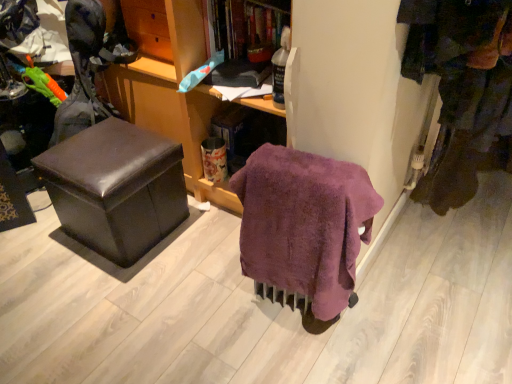
Question: Could you tell me if wooden shelf at upper center, which ranks as the first shelf in left-to-right order, is turned towards shiny brown ottoman at left?

Choices:
 (A) yes
 (B) no

Answer: (B)

Question: Considering the relative sizes of wooden shelf at upper center, which ranks as the first shelf in left-to-right order, and shiny brown ottoman at left in the image provided, is wooden shelf at upper center, which ranks as the first shelf in left-to-right order, thinner than shiny brown ottoman at left?

Choices:
 (A) yes
 (B) no

Answer: (A)

Question: Is the position of wooden shelf at upper center, which ranks as the first shelf in left-to-right order, more distant than that of shiny brown ottoman at left?

Choices:
 (A) no
 (B) yes

Answer: (B)

Question: Does wooden shelf at upper center, which ranks as the first shelf in left-to-right order, have a greater width compared to shiny brown ottoman at left?

Choices:
 (A) no
 (B) yes

Answer: (A)

Question: Is wooden shelf at upper center, which ranks as the first shelf in left-to-right order, shorter than shiny brown ottoman at left?

Choices:
 (A) yes
 (B) no

Answer: (A)

Question: Is wooden shelf at upper center, positioned as the 2th shelf in right-to-left order, far from shiny brown ottoman at left?

Choices:
 (A) no
 (B) yes

Answer: (A)

Question: Can we say purple fluffy blanket at center lies outside shiny brown ottoman at left?

Choices:
 (A) yes
 (B) no

Answer: (A)

Question: Is shiny brown ottoman at left a part of purple fluffy blanket at center?

Choices:
 (A) no
 (B) yes

Answer: (A)

Question: Does purple fluffy blanket at center come behind shiny brown ottoman at left?

Choices:
 (A) yes
 (B) no

Answer: (B)

Question: Considering the relative sizes of purple fluffy blanket at center and shiny brown ottoman at left in the image provided, is purple fluffy blanket at center smaller than shiny brown ottoman at left?

Choices:
 (A) no
 (B) yes

Answer: (B)

Question: Could you tell me if purple fluffy blanket at center is turned towards shiny brown ottoman at left?

Choices:
 (A) yes
 (B) no

Answer: (B)

Question: From a real-world perspective, is purple fluffy blanket at center beneath shiny brown ottoman at left?

Choices:
 (A) no
 (B) yes

Answer: (A)

Question: Is wooden cabinet at center at the back of dark brown fabric pants at right?

Choices:
 (A) yes
 (B) no

Answer: (A)